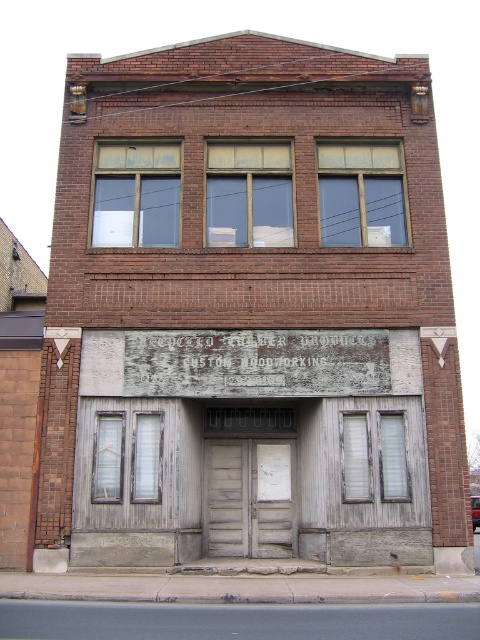
You are a delivery person who needs to place a wooden crate that is 1.5 meters wide. You see the matte glass window at center and the wooden at center. Which object can the crate fit in front of without overlapping?

The matte glass window at center has a width greater than the wooden at center. Since the crate is 1.5 meters wide, it can fit in front of the matte glass window at center if its width is at least 1.5 meters. However, the exact width of the window isn

Looking at this image, you are standing in front of the two story brick building described. You want to enter through the weathered wood door at center located at point (250,497). Is the door on the ground floor or the upper level?

The weathered wood door at center located at point (250,497) is on the ground floor because the ground floor has the sign mentioned, and the upper level has windows as described.

You are standing in front of the two story brick building. You see a matte glass window at center and a wooden at center. Which object is located to the right side?

The wooden at center is located to the right of the matte glass window at center.